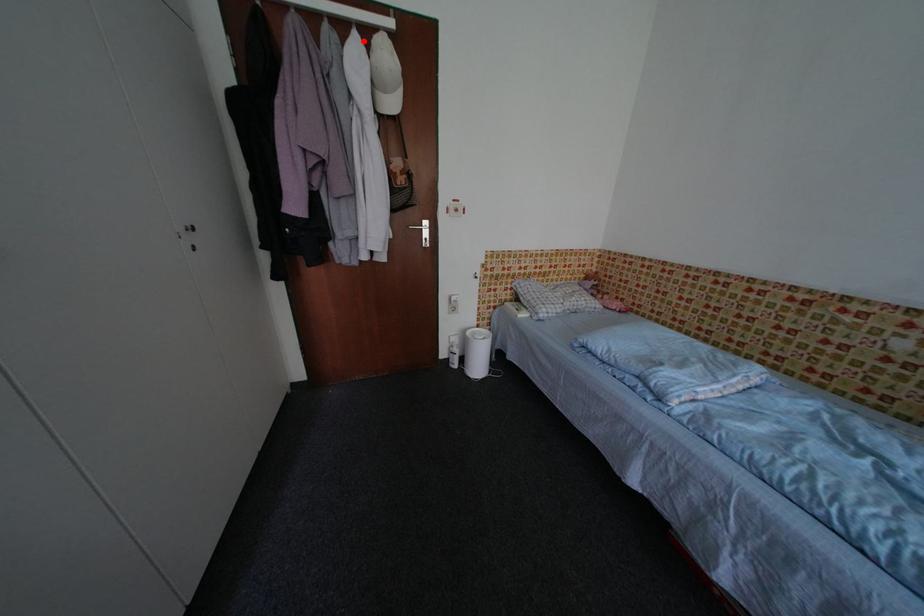
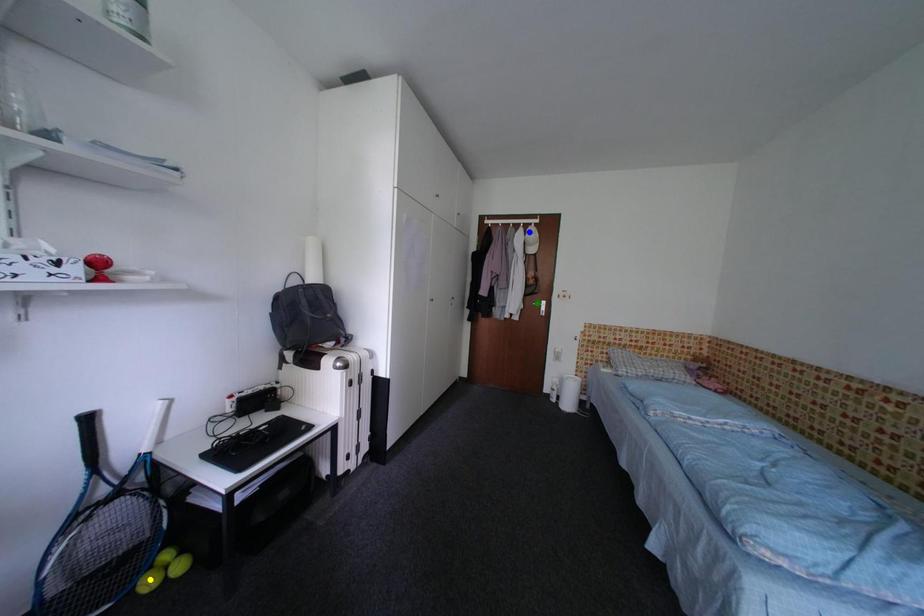
Question: I am providing you with two images of the same scene from different viewpoints. A red point is marked on the first image. You are given multiple points on the second image. Which spot in image 2 lines up with the point in image 1?

Choices:
 (A) green point
 (B) blue point
 (C) yellow point

Answer: (B)